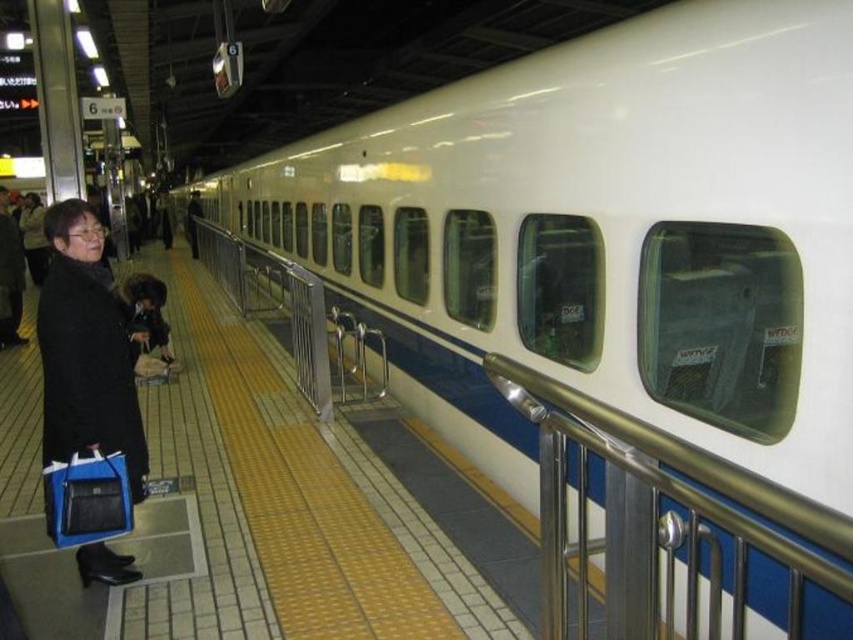
Describe the element at coordinates (665, 518) in the screenshot. I see `satin silver railing at center` at that location.

Does point (712, 486) come farther from viewer compared to point (131, 440)?

No, it is in front of (131, 440).

Which is behind, point (828, 586) or point (45, 230)?

The point (45, 230) is more distant.

At what (x,y) coordinates should I click in order to perform the action: click on satin silver railing at center. Please return your answer as a coordinate pair (x, y). Looking at the image, I should click on (665, 518).